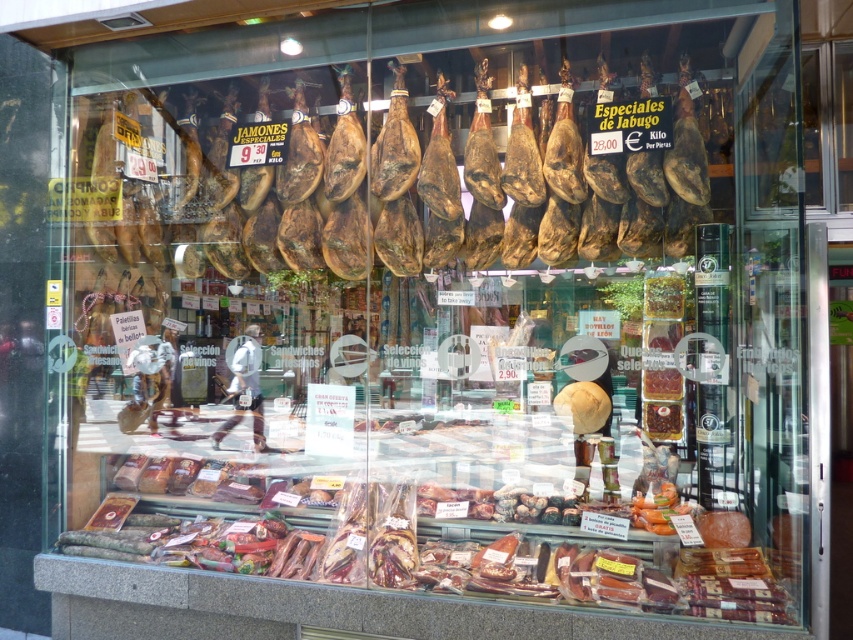
You are a customer looking at the deli display. You want to see the shiny brown meat at center but it is blocked by the brown leather ham at center. How can you adjust your position to view it better?

Since the shiny brown meat at center is behind the brown leather ham at center, you should move to a position where you can see around or past the brown leather ham at center to get a better view of the shiny brown meat at center.

You are a customer looking to buy a ham for a party. You need to choose between the brown leather ham at center and the shiny brown meat at center. Which one is wider?

The shiny brown meat at center is wider than the brown leather ham at center.